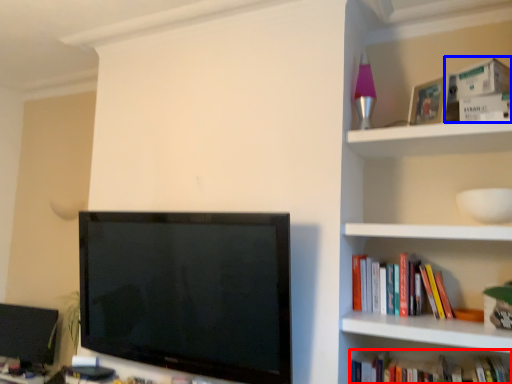
Question: Which of the following is the closest to the observer, book (highlighted by a red box) or paperback book (highlighted by a blue box)?

Choices:
 (A) book
 (B) paperback book

Answer: (A)